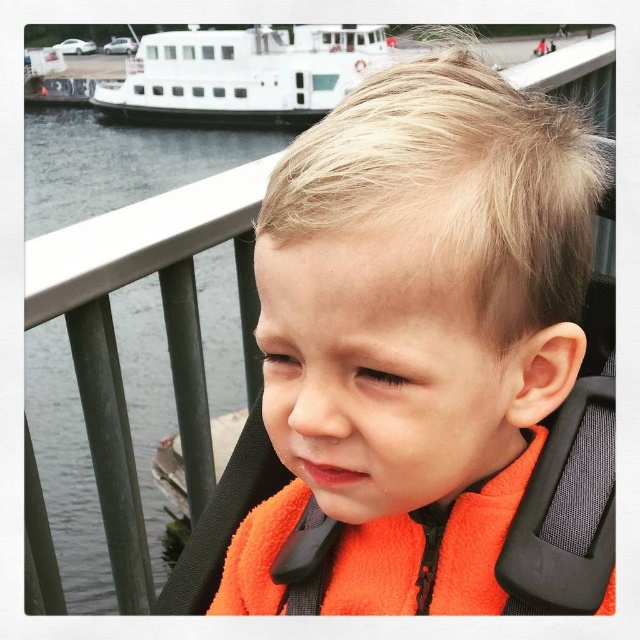
You are a photographer trying to capture a photo of the orange fabric at center and the white matte boat at upper left. Based on their sizes in the image, which object should you focus on first to ensure both are in frame without moving the camera?

The orange fabric at center is smaller than the white matte boat at upper left, so you should focus on the white matte boat at upper left first since it takes up more space in the frame and adjusting focus on the larger object ensures both will be in focus when using a camera with a wide enough depth of field.

You are a photographer trying to capture the child in the stroller while ensuring both the transparent water at left and the white matte boat at upper left are visible in the frame. Which object should you focus on to make sure both are in the shot?

Since the transparent water at left is bigger than the white matte boat at upper left, focusing on the transparent water at left will ensure both objects are included in the frame.

You are a photographer trying to capture the orange fabric at center and the white matte boat at upper left in the same frame. Based on their positions, which object would appear larger in your photo?

The orange fabric at center appears larger in the photo because it is closer to the viewer than the white matte boat at upper left.